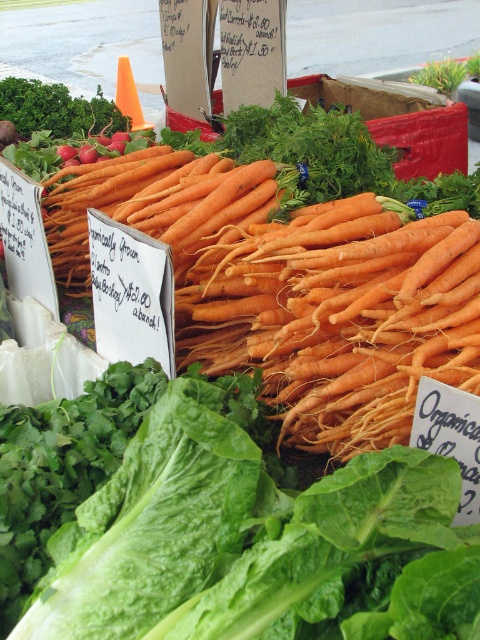
Is orange matte carrots at center above green leafy at upper left?

No.

Is point (292, 340) behind point (73, 113)?

No, (292, 340) is in front of (73, 113).

Find the location of a particular element. Image resolution: width=480 pixels, height=640 pixels. orange matte carrots at center is located at coordinates [x=317, y=298].

Is green leafy at center smaller than green leafy at upper left?

Actually, green leafy at center might be larger than green leafy at upper left.

Does green leafy at center have a lesser width compared to green leafy at upper left?

No.

At what (x,y) coordinates should I click in order to perform the action: click on green leafy at center. Please return your answer as a coordinate pair (x, y). The width and height of the screenshot is (480, 640). Looking at the image, I should click on (220, 525).

Is green leafy at center smaller than orange matte carrots at center?

Correct, green leafy at center occupies less space than orange matte carrots at center.

How much distance is there between green leafy at center and orange matte carrots at center?

A distance of 12.76 inches exists between green leafy at center and orange matte carrots at center.

Where is `green leafy at center`? green leafy at center is located at coordinates pos(220,525).